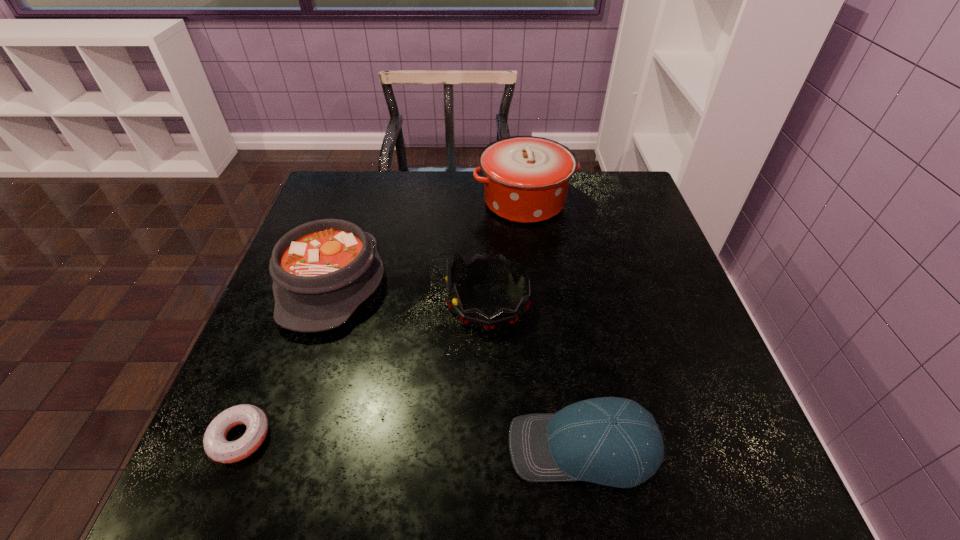
Find the location of a particular element. The height and width of the screenshot is (540, 960). vacant space at the far edge of the desktop is located at coordinates 476,210.

Locate an element on the screen. The image size is (960, 540). free space at the left edge of the desktop is located at coordinates (366, 223).

Identify the location of blank space at the right edge of the desktop. (707, 434).

In the image, there is a desktop. Where is `free space at the far right corner`? Image resolution: width=960 pixels, height=540 pixels. free space at the far right corner is located at coordinates (607, 217).

Image resolution: width=960 pixels, height=540 pixels. In the image, there is a desktop. In order to click on blank space at the near right corner in this screenshot , I will do `click(720, 467)`.

The image size is (960, 540). Identify the location of free space between the fourth tallest object and the third tallest object. (458, 365).

You are a GUI agent. You are given a task and a screenshot of the screen. Output one action in this format:
    pyautogui.click(x=<x>, y=<y>)
    Task: Click on the vacant space that's between the shortest object and the farther casserole
    
    Given the screenshot: What is the action you would take?
    pyautogui.click(x=382, y=319)

Locate an element on the screen. The width and height of the screenshot is (960, 540). free area in between the tiara and the shortest object is located at coordinates (364, 369).

You are a GUI agent. You are given a task and a screenshot of the screen. Output one action in this format:
    pyautogui.click(x=<x>, y=<y>)
    Task: Click on the free point between the fourth tallest object and the doughnut
    The width and height of the screenshot is (960, 540).
    Given the screenshot: What is the action you would take?
    pyautogui.click(x=412, y=442)

This screenshot has width=960, height=540. Find the location of `vacant area that lies between the tallest object and the left casserole`. vacant area that lies between the tallest object and the left casserole is located at coordinates (428, 242).